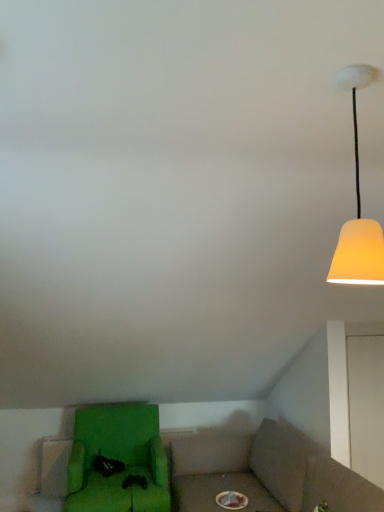
Question: Is green fabric chair at lower left facing towards matte yellow lampshade at upper right?

Choices:
 (A) no
 (B) yes

Answer: (A)

Question: Considering the relative positions of green fabric chair at lower left and matte yellow lampshade at upper right in the image provided, is green fabric chair at lower left to the left of matte yellow lampshade at upper right from the viewer's perspective?

Choices:
 (A) no
 (B) yes

Answer: (B)

Question: Is green fabric chair at lower left looking in the opposite direction of matte yellow lampshade at upper right?

Choices:
 (A) yes
 (B) no

Answer: (B)

Question: From a real-world perspective, is green fabric chair at lower left positioned under matte yellow lampshade at upper right based on gravity?

Choices:
 (A) yes
 (B) no

Answer: (A)

Question: From the image's perspective, is green fabric chair at lower left on matte yellow lampshade at upper right?

Choices:
 (A) yes
 (B) no

Answer: (B)

Question: Does green fabric chair at lower left have a larger size compared to matte yellow lampshade at upper right?

Choices:
 (A) yes
 (B) no

Answer: (A)

Question: Does matte yellow lampshade at upper right have a larger size compared to green fabric chair at lower left?

Choices:
 (A) yes
 (B) no

Answer: (B)

Question: Is matte yellow lampshade at upper right far from green fabric chair at lower left?

Choices:
 (A) yes
 (B) no

Answer: (A)

Question: Is matte yellow lampshade at upper right facing away from green fabric chair at lower left?

Choices:
 (A) no
 (B) yes

Answer: (A)

Question: Considering the relative sizes of matte yellow lampshade at upper right and green fabric chair at lower left in the image provided, is matte yellow lampshade at upper right wider than green fabric chair at lower left?

Choices:
 (A) yes
 (B) no

Answer: (B)

Question: Does matte yellow lampshade at upper right lie in front of green fabric chair at lower left?

Choices:
 (A) yes
 (B) no

Answer: (A)

Question: Can you confirm if matte yellow lampshade at upper right is positioned to the left of green fabric chair at lower left?

Choices:
 (A) no
 (B) yes

Answer: (A)

Question: Would you say green fabric chair at lower left is inside or outside matte yellow lampshade at upper right?

Choices:
 (A) inside
 (B) outside

Answer: (B)